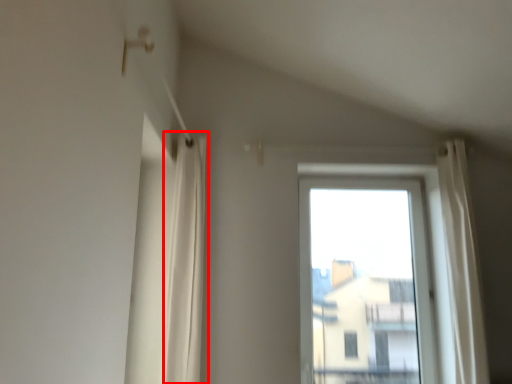
Question: From the image, what is the correct spatial relationship of shower curtain (annotated by the red box) in relation to window?

Choices:
 (A) left
 (B) right

Answer: (A)